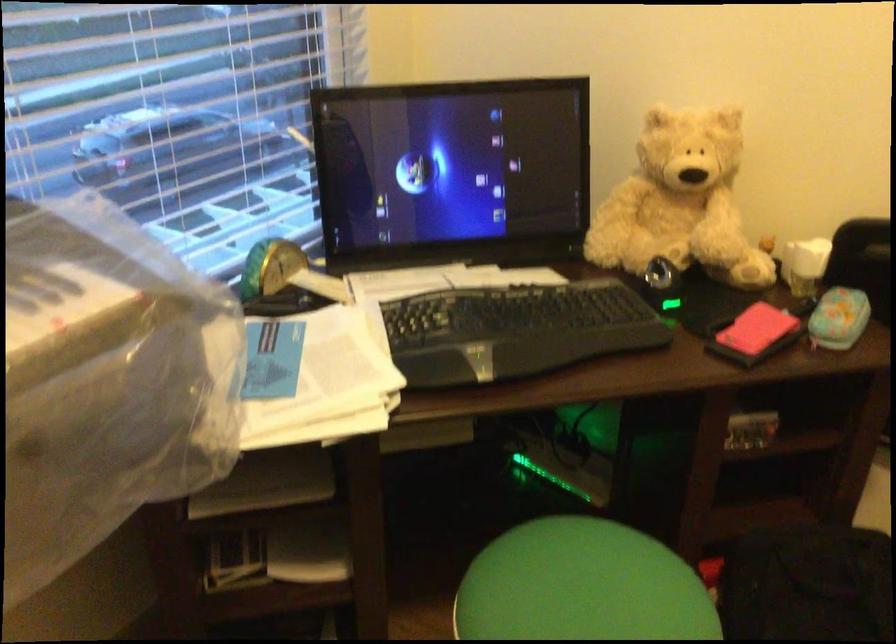
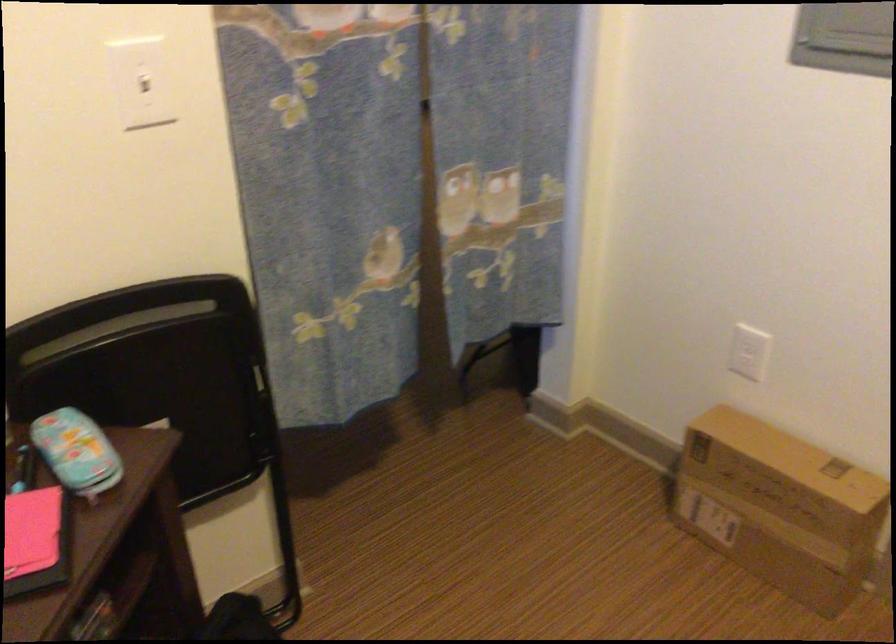
How did the camera likely rotate?

The camera rotated toward right-down.